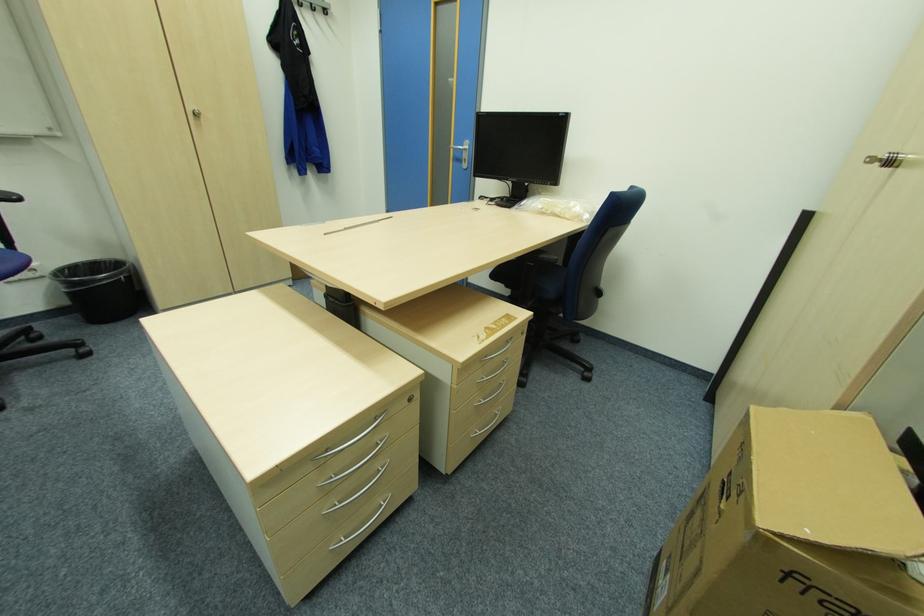
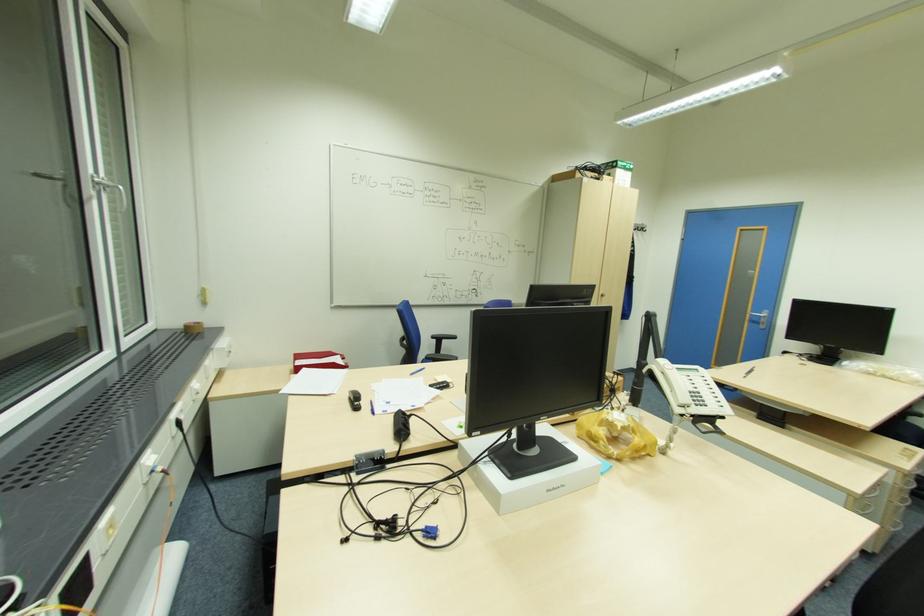
Which direction would the cameraman need to move to produce the second image?

The cameraman moved toward left, backward.